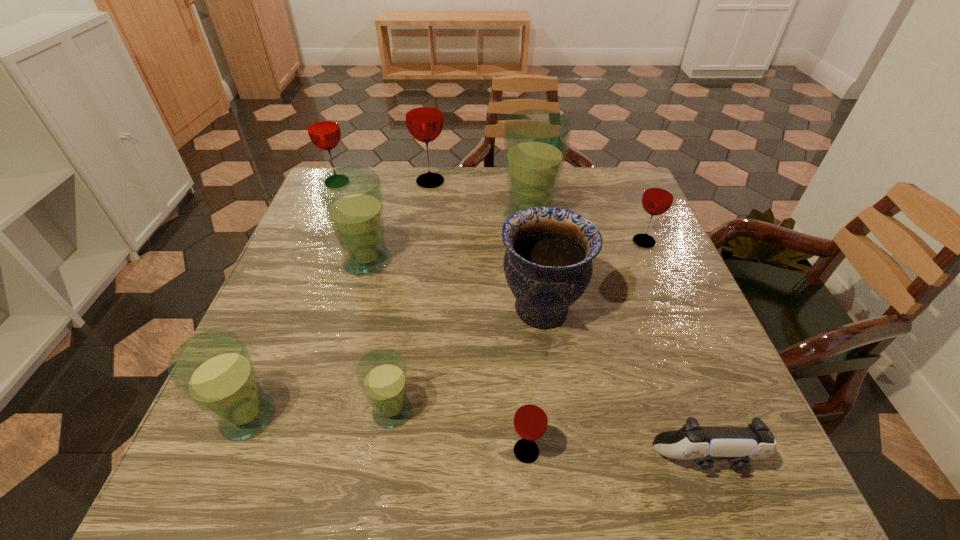
Locate an element on the screen. This screenshot has height=540, width=960. unoccupied position between the smallest red glass and the eighth object from right to left is located at coordinates (446, 356).

Identify the location of vacant point located between the nearest red glass and the third biggest blue glass. Image resolution: width=960 pixels, height=540 pixels. (387, 434).

Locate an element on the screen. free spot between the third blue glass from left to right and the third red glass from left to right is located at coordinates coord(459,431).

This screenshot has width=960, height=540. What are the coordinates of `free point between the second smallest blue glass and the leftmost red glass` in the screenshot? It's located at (293, 300).

Identify the location of empty space between the second biggest red glass and the biggest blue glass. (433, 200).

The height and width of the screenshot is (540, 960). I want to click on empty space that is in between the nearest red glass and the control, so click(x=615, y=456).

Locate which object ranks seventh in proximity to the shortest object. Please provide its 2D coordinates. Your answer should be formatted as a tuple, i.e. [(x, y)], where the tuple contains the x and y coordinates of a point satisfying the conditions above.

[(214, 369)]

The image size is (960, 540). In order to click on object that can be found as the third closest to the smallest blue glass in this screenshot , I will do `click(548, 265)`.

This screenshot has width=960, height=540. What are the coordinates of `glass that is the third nearest to the pottery` in the screenshot? It's located at (530, 421).

In order to click on glass that is the nearest to the second nearest red glass in this screenshot , I will do `click(536, 141)`.